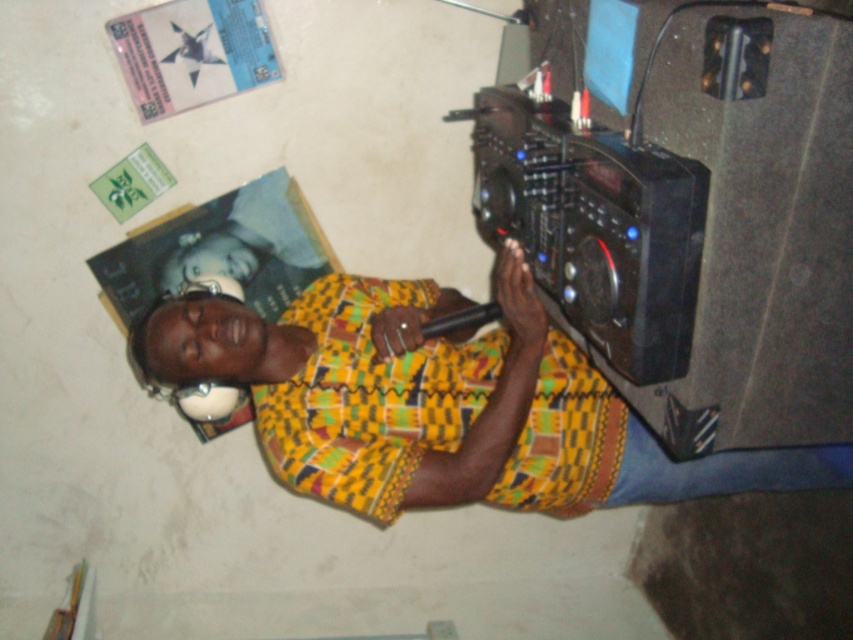
Can you confirm if black matte speaker at right is positioned to the right of black plastic video camera at right?

Correct, you'll find black matte speaker at right to the right of black plastic video camera at right.

Can you confirm if black matte speaker at right is positioned above black plastic video camera at right?

Yes.

This screenshot has width=853, height=640. I want to click on black matte speaker at right, so click(685, 205).

I want to click on black matte speaker at right, so click(685, 205).

Who is positioned more to the left, black matte speaker at right or yellow printed shirt at center?

yellow printed shirt at center

Image resolution: width=853 pixels, height=640 pixels. Describe the element at coordinates (685, 205) in the screenshot. I see `black matte speaker at right` at that location.

Find the location of `black matte speaker at right`. black matte speaker at right is located at coordinates [x=685, y=205].

Between point (576, 493) and point (581, 292), which one is positioned in front?

Point (581, 292)

Between yellow printed shirt at center and black plastic video camera at right, which one has less height?

black plastic video camera at right

Does point (723, 472) lie in front of point (569, 323)?

No, (723, 472) is behind (569, 323).

Locate an element on the screen. yellow printed shirt at center is located at coordinates coord(442,403).